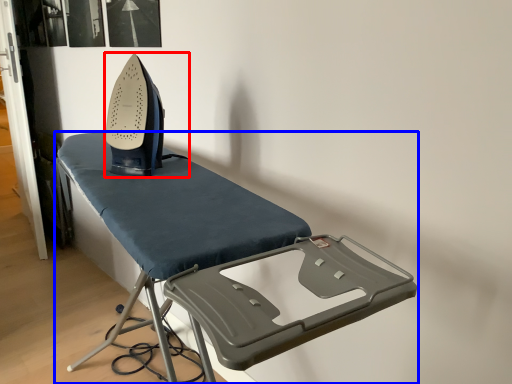
Question: Among these objects, which one is farthest to the camera, equipment (highlighted by a red box) or furniture (highlighted by a blue box)?

Choices:
 (A) equipment
 (B) furniture

Answer: (A)